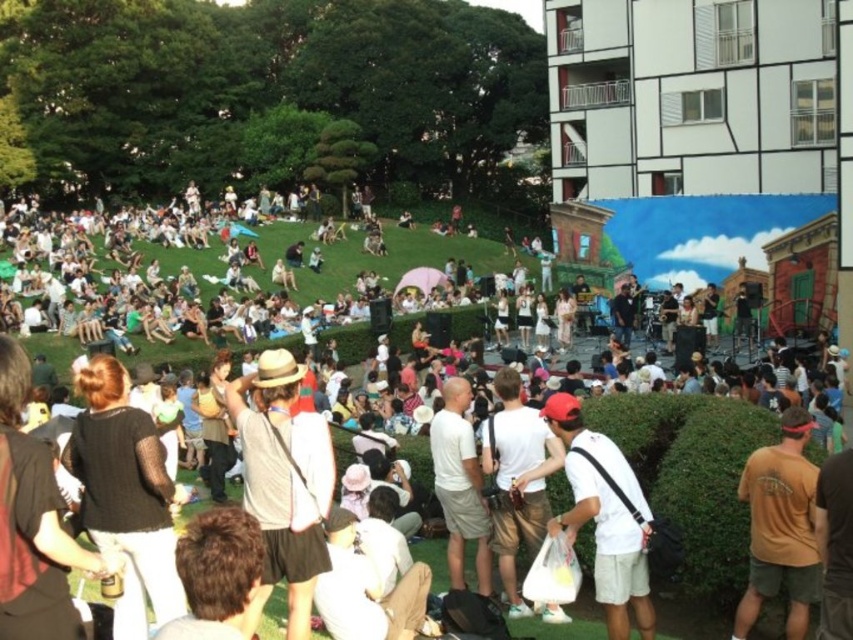
Question: Which of these objects is positioned closest to the brown cotton t-shirt at lower right?

Choices:
 (A) white matte baseball cap at center
 (B) white cotton shirt at center

Answer: (A)

Question: Is white cotton shirt at center smaller than brown cotton t-shirt at lower right?

Choices:
 (A) no
 (B) yes

Answer: (A)

Question: Can you confirm if white cotton shirt at center is smaller than white matte baseball cap at center?

Choices:
 (A) no
 (B) yes

Answer: (A)

Question: Which of the following is the closest to the observer?

Choices:
 (A) (787, 428)
 (B) (318, 426)
 (C) (178, 422)

Answer: (A)

Question: Is white cotton shirt at center positioned in front of white matte baseball cap at center?

Choices:
 (A) no
 (B) yes

Answer: (B)

Question: Which object is closer to the camera taking this photo?

Choices:
 (A) light brown straw hat at center
 (B) white matte baseball cap at center

Answer: (A)